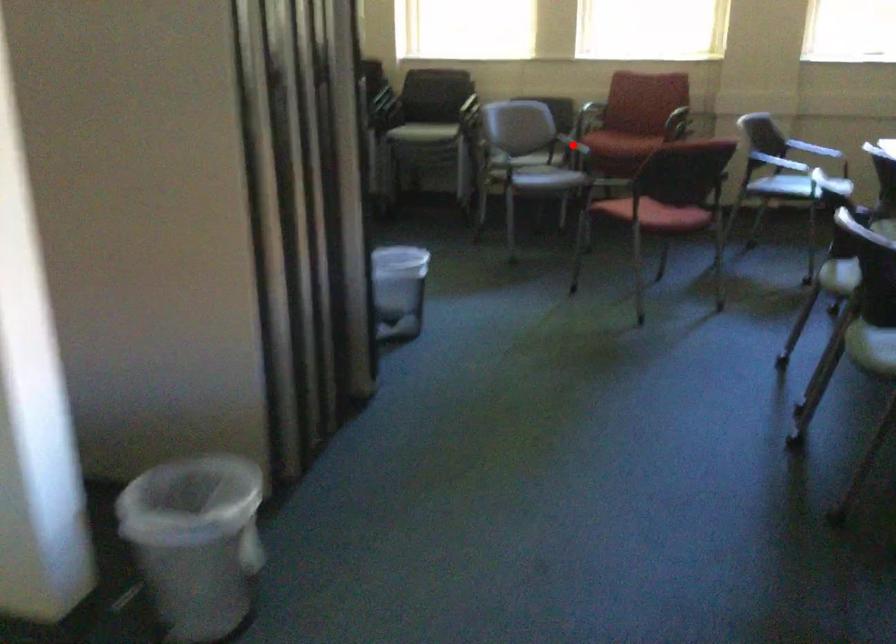
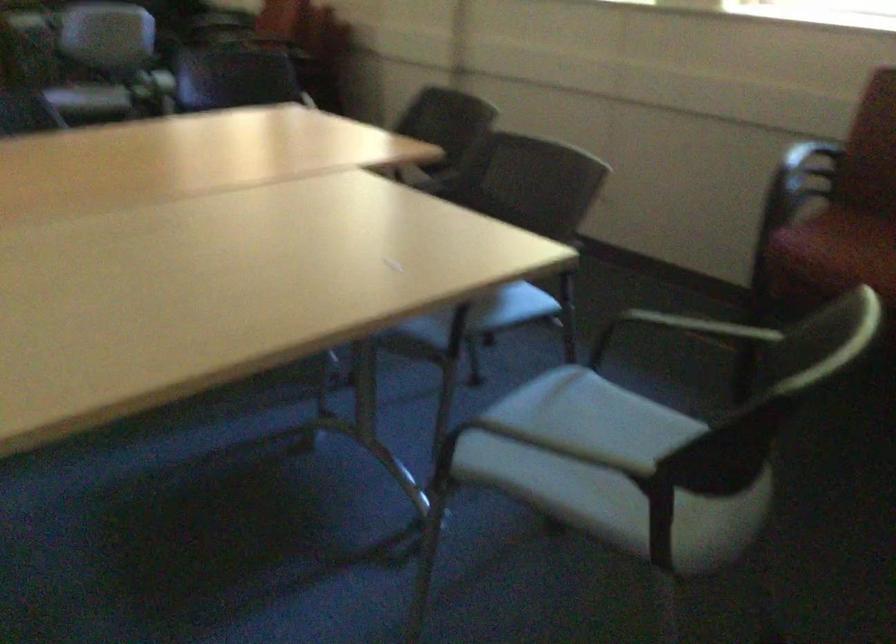
Question: I am providing you with two images of the same scene from different viewpoints. A red point is marked on the first image. Can you still see the location of the red point in image 2?

Choices:
 (A) Yes
 (B) No

Answer: (B)